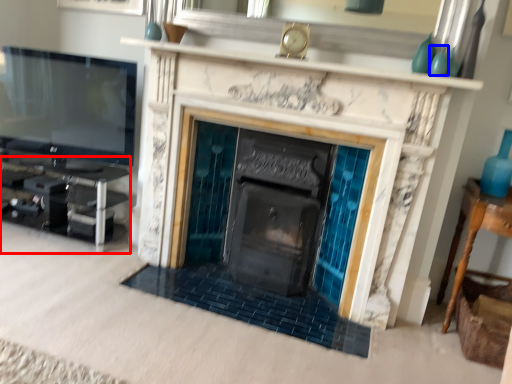
Question: Which of the following is the farthest to the observer, entertainment center (highlighted by a red box) or turquoise (highlighted by a blue box)?

Choices:
 (A) entertainment center
 (B) turquoise

Answer: (A)